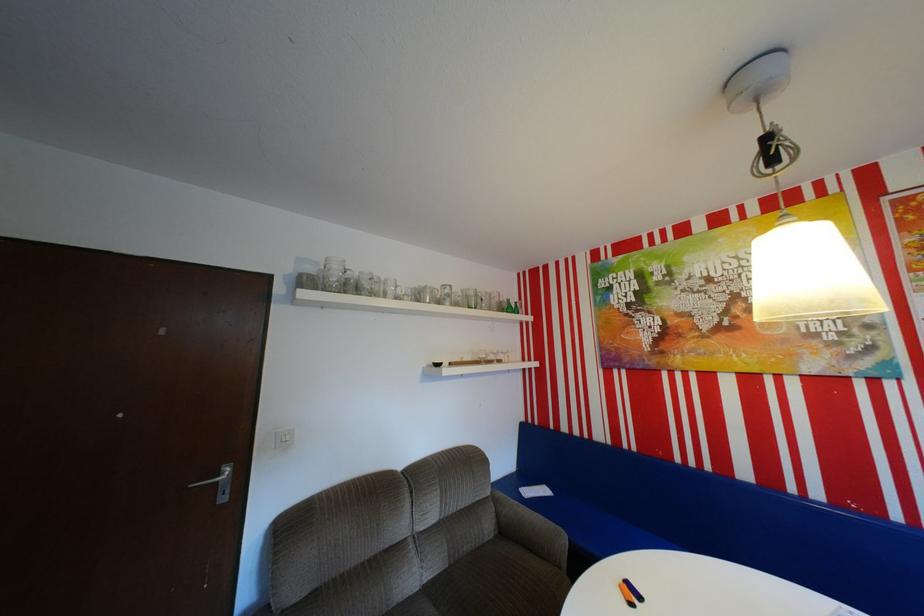
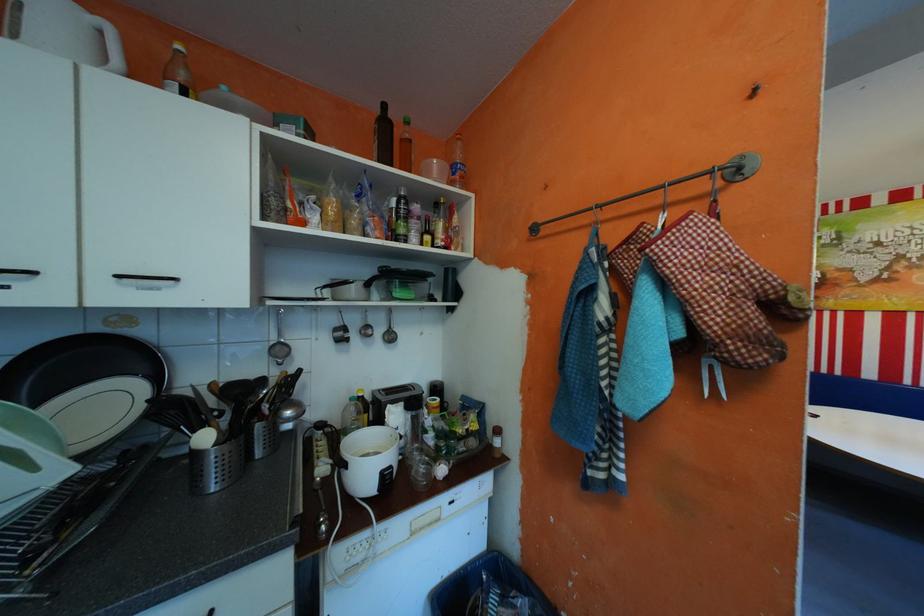
The images are taken continuously from a first-person perspective. In which direction are you moving?

The movement direction of the cameraman is left, backward.